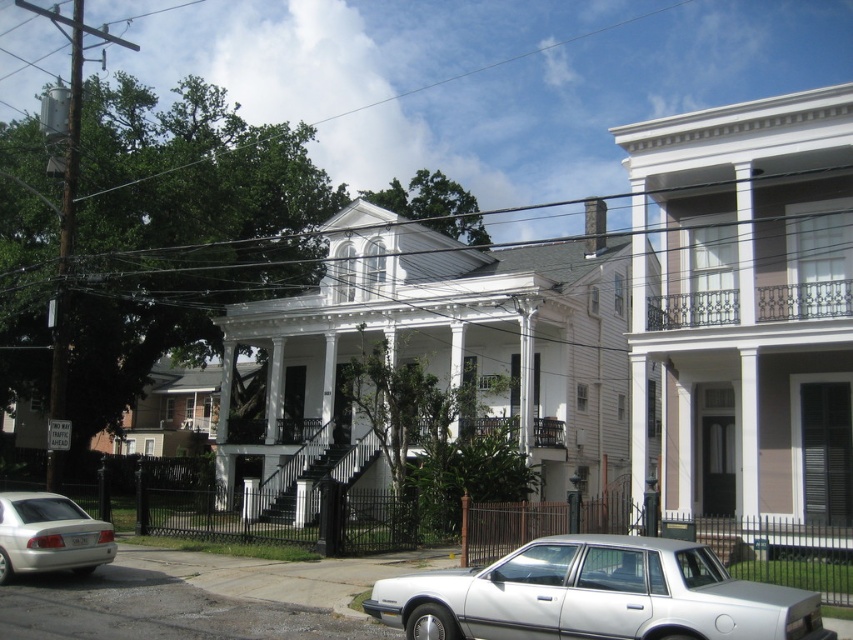
Based on the photo, you are a delivery driver who needs to park your truck, which is 6 meters long, in the street. You see the white matte sedan at lower center and the silver metallic sedan at lower left. Can you park your truck between them without overlapping either vehicle?

The white matte sedan at lower center is larger than the silver metallic sedan at lower left. However, the distance between them is not specified in the provided information, so it is impossible to determine if the truck can fit. Please check the actual space available.

In the scene shown: You are a delivery person trying to park your van in the street between the two houses. You notice the white matte sedan at lower center and the silver metallic sedan at lower left. Which car is blocking your path to the parking spot?

The white matte sedan at lower center is blocking your path because it is in front of the silver metallic sedan at lower left.

You are standing at the entrance of the house on the left and want to park your car at the white matte sedan at lower center. What are the coordinates of the parking spot?

The coordinates of the white matte sedan at lower center are at point (595, 595).